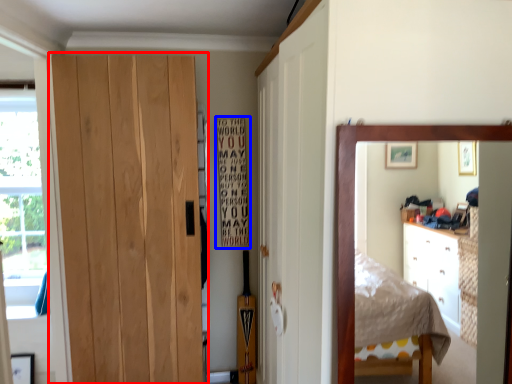
Question: Which object appears farthest to the camera in this image, door (highlighted by a red box) or bulletin board (highlighted by a blue box)?

Choices:
 (A) door
 (B) bulletin board

Answer: (B)